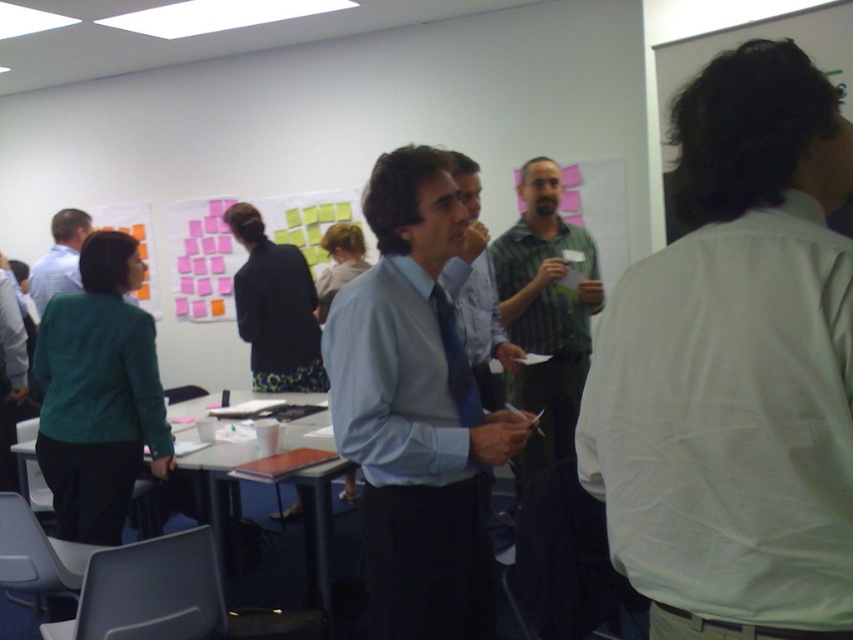
Question: Which object appears closest to the camera in this image?

Choices:
 (A) light blue shirt at center
 (B) green striped shirt at center
 (C) matte blue shirt at center

Answer: (A)

Question: Is pink paper notes at center to the right of matte blue shirt at center from the viewer's perspective?

Choices:
 (A) no
 (B) yes

Answer: (A)

Question: Is light blue shirt at center wider than green striped shirt at center?

Choices:
 (A) no
 (B) yes

Answer: (B)

Question: Based on their relative distances, which object is farther from the white cotton shirt at upper right?

Choices:
 (A) light blue shirt at center
 (B) green striped shirt at center

Answer: (B)

Question: Which object appears closest to the camera in this image?

Choices:
 (A) blue satin tie at center
 (B) light blue shirt at center

Answer: (B)

Question: Does matte blue shirt at center have a lesser width compared to matte green shirt at left?

Choices:
 (A) no
 (B) yes

Answer: (B)